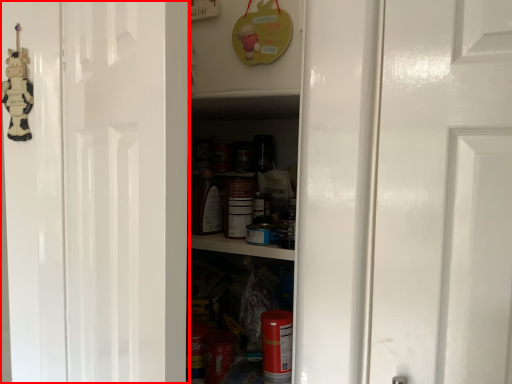
Question: From the image's perspective, considering the relative positions of door (annotated by the red box) and toy in the image provided, where is door (annotated by the red box) located with respect to the staircase?

Choices:
 (A) below
 (B) above

Answer: (A)